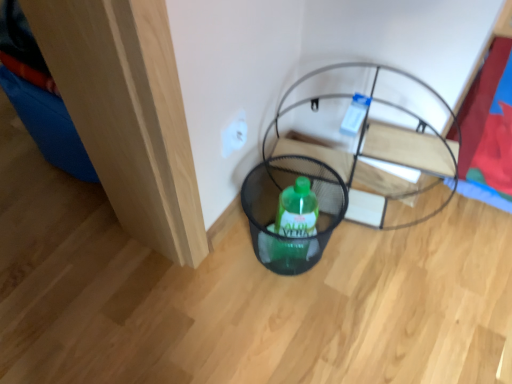
Question: From the image's perspective, does white plastic electric outlet at center appear lower than black mesh basket at center?

Choices:
 (A) yes
 (B) no

Answer: (B)

Question: From the image's perspective, does white plastic electric outlet at center appear higher than black mesh basket at center?

Choices:
 (A) no
 (B) yes

Answer: (B)

Question: Is the position of white plastic electric outlet at center less distant than that of black mesh basket at center?

Choices:
 (A) yes
 (B) no

Answer: (B)

Question: Is white plastic electric outlet at center taller than black mesh basket at center?

Choices:
 (A) yes
 (B) no

Answer: (B)

Question: Is white plastic electric outlet at center oriented towards black mesh basket at center?

Choices:
 (A) no
 (B) yes

Answer: (A)

Question: Does white plastic electric outlet at center contain black mesh basket at center?

Choices:
 (A) yes
 (B) no

Answer: (B)

Question: From a real-world perspective, is black mesh basket at lower center physically above white plastic electric outlet at center?

Choices:
 (A) yes
 (B) no

Answer: (B)

Question: From the image's perspective, is black mesh basket at lower center below white plastic electric outlet at center?

Choices:
 (A) no
 (B) yes

Answer: (B)

Question: Is white plastic electric outlet at center completely or partially inside black mesh basket at lower center?

Choices:
 (A) yes
 (B) no

Answer: (B)

Question: Can you confirm if black mesh basket at lower center is shorter than white plastic electric outlet at center?

Choices:
 (A) yes
 (B) no

Answer: (B)

Question: Can you confirm if black mesh basket at lower center is thinner than white plastic electric outlet at center?

Choices:
 (A) yes
 (B) no

Answer: (B)

Question: Are black mesh basket at lower center and white plastic electric outlet at center making contact?

Choices:
 (A) yes
 (B) no

Answer: (B)

Question: Is black mesh basket at lower center at the right side of black mesh basket at center?

Choices:
 (A) no
 (B) yes

Answer: (A)